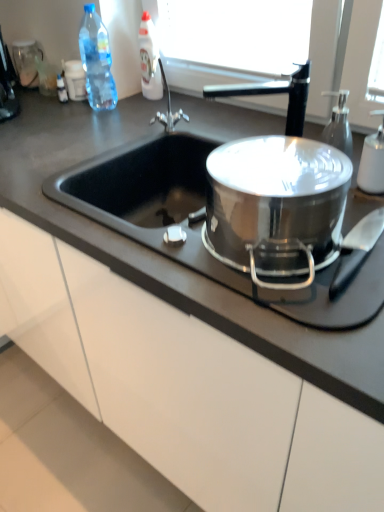
In order to click on vacant region to the left of transparent plastic bottle at upper left, arranged as the first bottle when viewed from the left in this screenshot , I will do `click(56, 115)`.